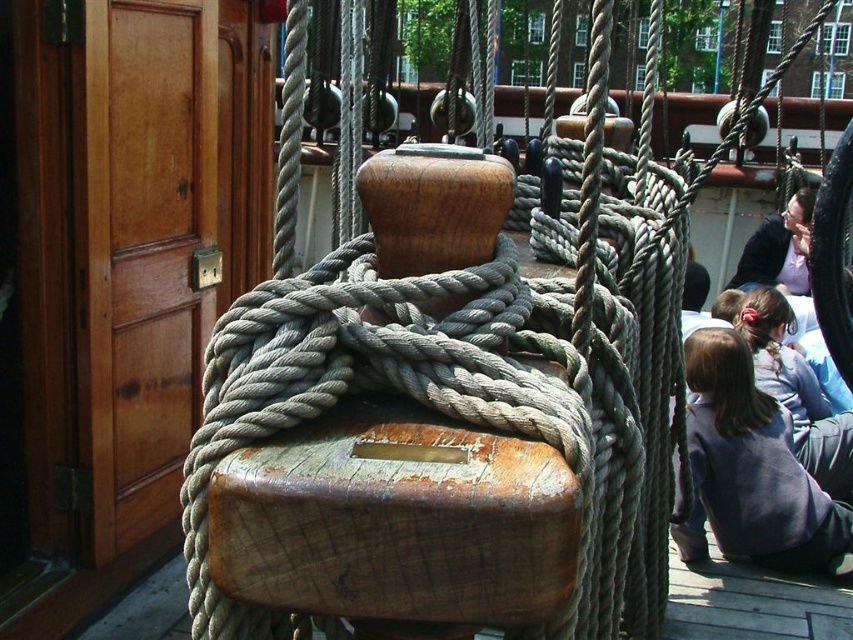
Question: Can you confirm if light brown hair at lower right is positioned below dark hair at lower right?

Choices:
 (A) no
 (B) yes

Answer: (B)

Question: Considering the relative positions of dark gray sweatshirt at lower right and dark hair at lower right in the image provided, where is dark gray sweatshirt at lower right located with respect to dark hair at lower right?

Choices:
 (A) left
 (B) right

Answer: (A)

Question: Which is farther from the dark gray sweatshirt at lower right?

Choices:
 (A) dark hair at lower right
 (B) light brown hair at lower right

Answer: (A)

Question: Does light brown hair at lower right lie in front of dark hair at lower right?

Choices:
 (A) yes
 (B) no

Answer: (A)

Question: Estimate the real-world distances between objects in this image. Which object is farther from the light brown hair at lower right?

Choices:
 (A) dark gray sweatshirt at lower right
 (B) dark hair at lower right

Answer: (B)

Question: Among these points, which one is nearest to the camera?

Choices:
 (A) (766, 374)
 (B) (804, 474)
 (C) (785, 268)

Answer: (B)